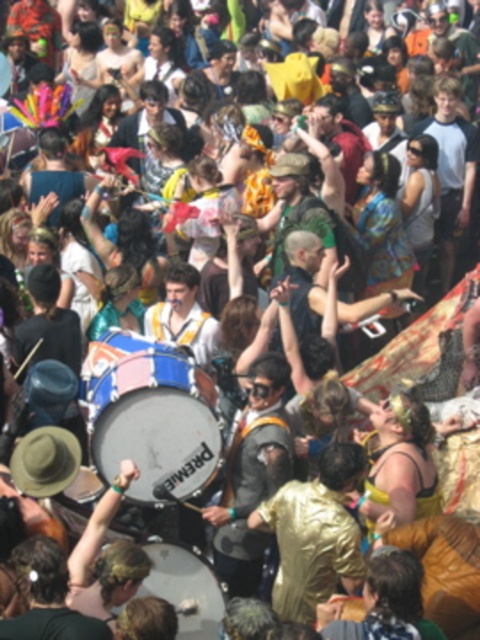
From the picture: Who is more forward, (117, 356) or (200, 595)?

Point (200, 595)

Is matte blue drum at center to the right of white drum at center from the viewer's perspective?

No, matte blue drum at center is not to the right of white drum at center.

Based on the photo, who is more forward, [105,340] or [182,560]?

Positioned in front is point [182,560].

Where is `matte blue drum at center`? matte blue drum at center is located at coordinates (152, 417).